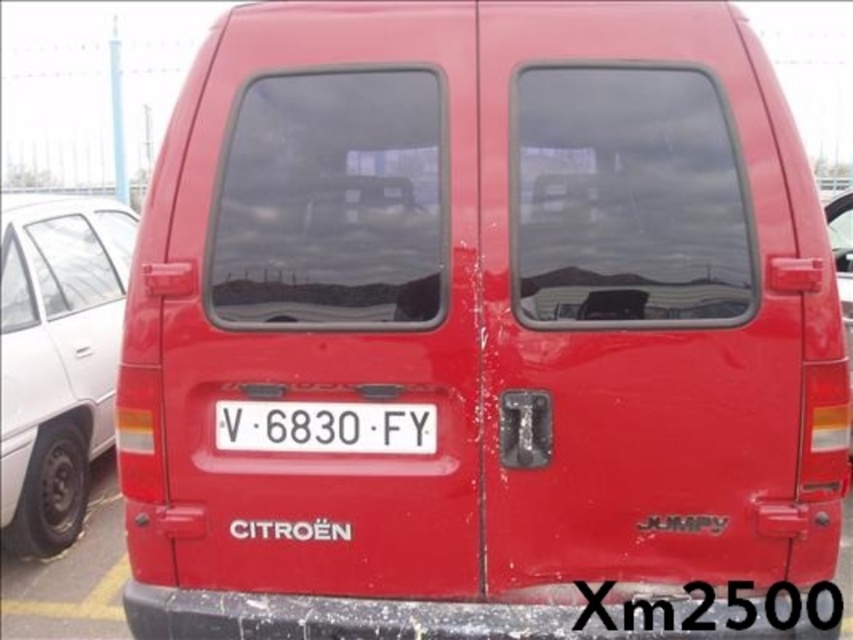
You are a parking attendant checking the rear of a van. You see the matte white car at left and the white plastic license plate at center. Which object is closer to the license plate?

The matte white car at left is positioned over the white plastic license plate at center, so the matte white car at left is closer to the license plate.